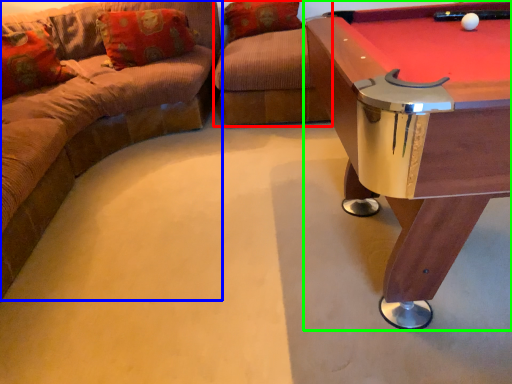
Question: Based on their relative distances, which object is farther from swivel chair (highlighted by a red box)? Choose from studio couch (highlighted by a blue box) and table (highlighted by a green box).

Choices:
 (A) studio couch
 (B) table

Answer: (B)